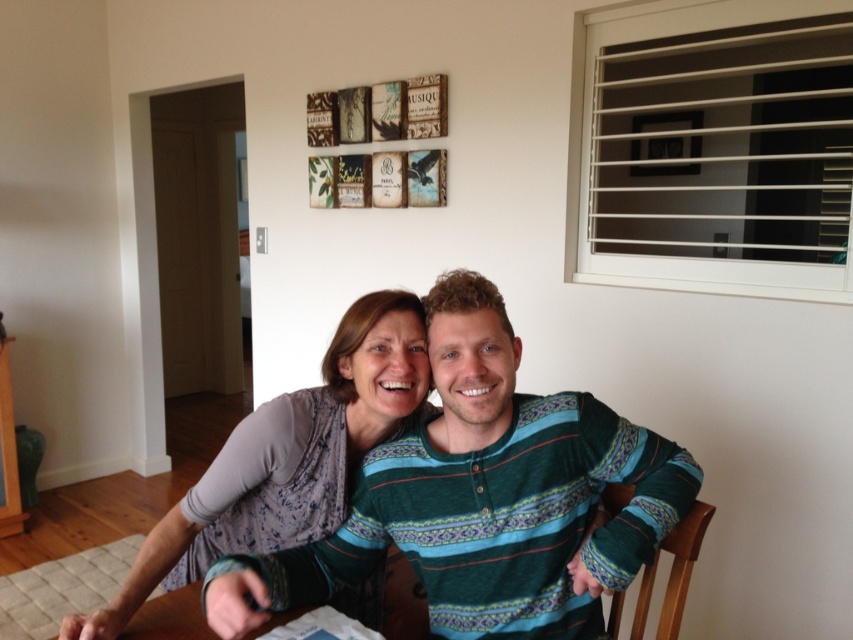
Question: Which object is farther from the camera taking this photo?

Choices:
 (A) striped cotton shirt at center
 (B) matte gray shirt at center

Answer: (B)

Question: Among these points, which one is farthest from the camera?

Choices:
 (A) 312,470
 (B) 561,480

Answer: (A)

Question: Can you confirm if striped cotton shirt at center is bigger than matte gray shirt at center?

Choices:
 (A) yes
 (B) no

Answer: (B)

Question: Is striped cotton shirt at center smaller than matte gray shirt at center?

Choices:
 (A) no
 (B) yes

Answer: (B)

Question: Does striped cotton shirt at center lie behind matte gray shirt at center?

Choices:
 (A) yes
 (B) no

Answer: (B)

Question: Which point is farther from the camera taking this photo?

Choices:
 (A) (399, 388)
 (B) (582, 602)

Answer: (A)